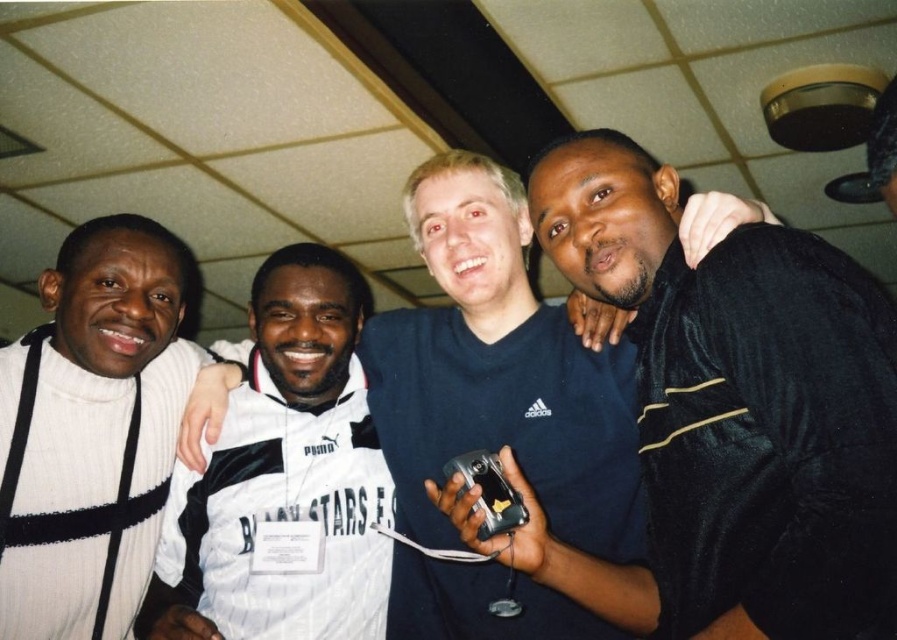
Is white jersey at center shorter than white striped jersey at center?

No, white jersey at center is not shorter than white striped jersey at center.

Does white jersey at center have a lesser width compared to white striped jersey at center?

Incorrect, white jersey at center's width is not less than white striped jersey at center's.

Does point (567, 468) lie in front of point (225, 515)?

Yes, it is.

Image resolution: width=897 pixels, height=640 pixels. Find the location of `white jersey at center`. white jersey at center is located at coordinates (501, 372).

Is black matte camera at center shorter than white striped jersey at center?

In fact, black matte camera at center may be taller than white striped jersey at center.

What do you see at coordinates (730, 413) in the screenshot? I see `black matte camera at center` at bounding box center [730, 413].

This screenshot has width=897, height=640. Identify the location of black matte camera at center. (730, 413).

Is point (761, 467) farther from viewer compared to point (79, 266)?

No, (761, 467) is closer to viewer.

Can you confirm if black matte camera at center is thinner than white ribbed sweater at left?

No, black matte camera at center is not thinner than white ribbed sweater at left.

Who is more forward, (672, 545) or (161, 449)?

Point (672, 545) is more forward.

The height and width of the screenshot is (640, 897). I want to click on black matte camera at center, so click(730, 413).